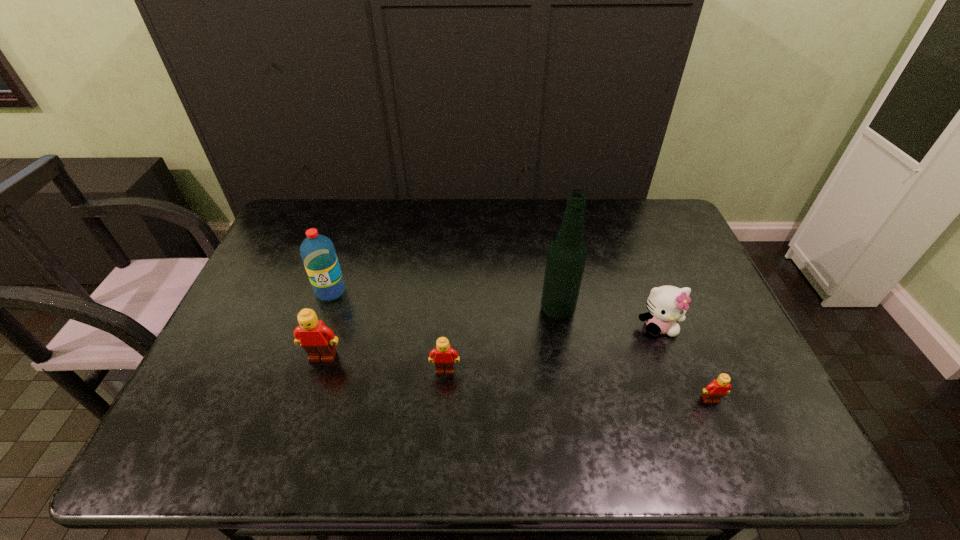
Where is `free space between the leftmost Lego and the tallest object`? The width and height of the screenshot is (960, 540). free space between the leftmost Lego and the tallest object is located at coordinates (440, 334).

The height and width of the screenshot is (540, 960). I want to click on vacant point located between the tallest Lego and the water bottle, so click(x=326, y=324).

Where is `vacant space that's between the third object from left to right and the water bottle`? The image size is (960, 540). vacant space that's between the third object from left to right and the water bottle is located at coordinates (388, 330).

This screenshot has width=960, height=540. In order to click on the fifth closest object to the water bottle in this screenshot , I will do `click(718, 388)`.

Point out which object is positioned as the fifth nearest to the tallest object. Please provide its 2D coordinates. Your answer should be formatted as a tuple, i.e. [(x, y)], where the tuple contains the x and y coordinates of a point satisfying the conditions above.

[(318, 254)]

You are a GUI agent. You are given a task and a screenshot of the screen. Output one action in this format:
    pyautogui.click(x=<x>, y=<y>)
    Task: Click on the Lego object that ranks as the second closest to the third object from left to right
    This screenshot has width=960, height=540.
    Given the screenshot: What is the action you would take?
    pyautogui.click(x=718, y=388)

Find the location of `the second closest Lego relative to the tallest object`. the second closest Lego relative to the tallest object is located at coordinates (718, 388).

Locate an element on the screen. The image size is (960, 540). free space that satisfies the following two spatial constraints: 1. on the front label of the alcohol; 2. on the left side of the second tallest object is located at coordinates (324, 310).